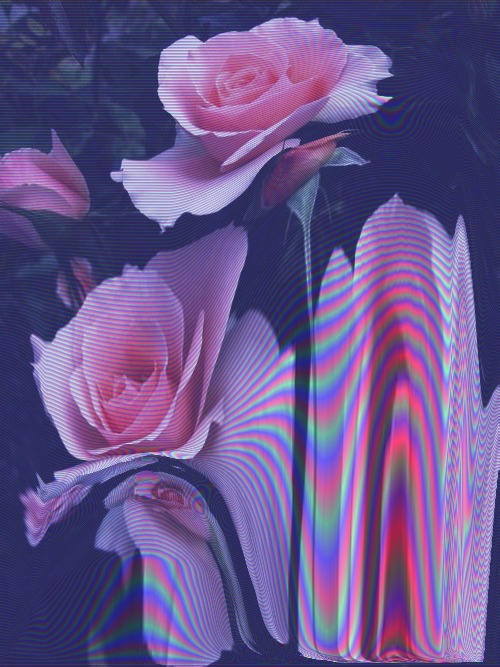
This screenshot has height=667, width=500. I want to click on tv screen, so click(342, 529).